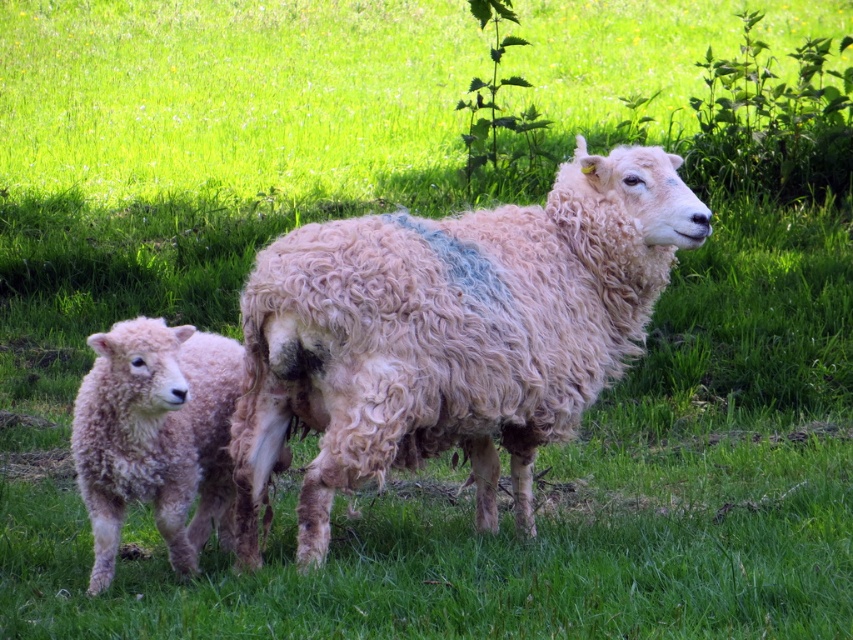
From the picture: You are a photographer trying to capture both the curly woolen sheep at center and the fuzzy woolen lamb at left in a single shot. Based on their positions, which animal is closer to the camera?

The fuzzy woolen lamb at left is closer to the camera because the curly woolen sheep at center is positioned over it, indicating it is farther away.

You are standing in the field and want to place a small treat for the sheep. If you drop the treat exactly halfway between point (338, 307) and point (115, 544), will the treat land closer to the adult sheep or the lamb?

The treat will land closer to the lamb because point (338, 307) is closer to the camera than point (115, 544), meaning the lamb is nearer to you. The halfway point between them would still be closer to the lamb since it starts nearer.

You are standing in the field and want to take a photo of the curly woolen sheep at center. If your camera has a maximum focus range of 3 meters, will you be able to capture it clearly?

The curly woolen sheep at center is 3.68 meters away from camera, which exceeds the camera maximum focus range of 3 meters. So you cannot capture it clearly.